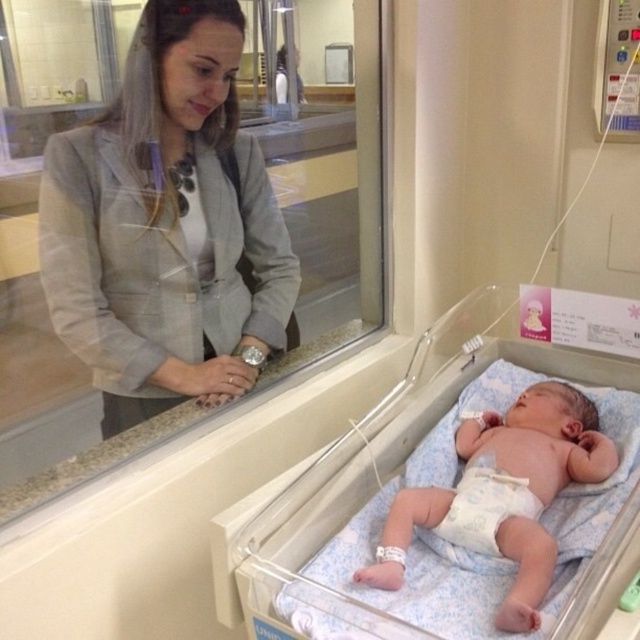
Who is shorter, white fabric hospital bed at lower center or white cloth diaper at center?

With less height is white cloth diaper at center.

Is white fabric hospital bed at lower center in front of white cloth diaper at center?

That is True.

What do you see at coordinates (369, 472) in the screenshot?
I see `white fabric hospital bed at lower center` at bounding box center [369, 472].

You are a GUI agent. You are given a task and a screenshot of the screen. Output one action in this format:
    pyautogui.click(x=<x>, y=<y>)
    Task: Click on the white fabric hospital bed at lower center
    The image size is (640, 640).
    Given the screenshot: What is the action you would take?
    pyautogui.click(x=369, y=472)

Is point (230, 116) less distant than point (465, 502)?

No, (230, 116) is further to viewer.

Is gray textured blazer at upper left positioned at the back of light blue diapered baby at lower right?

Yes, gray textured blazer at upper left is further from the viewer.

Does point (220, 241) lie behind point (600, 465)?

Yes.

What are the coordinates of `gray textured blazer at upper left` in the screenshot? It's located at (166, 225).

Does light blue diapered baby at lower right have a larger size compared to white cloth diaper at center?

Yes, light blue diapered baby at lower right is bigger than white cloth diaper at center.

The image size is (640, 640). Describe the element at coordinates (502, 493) in the screenshot. I see `light blue diapered baby at lower right` at that location.

Identify the location of light blue diapered baby at lower right. (502, 493).